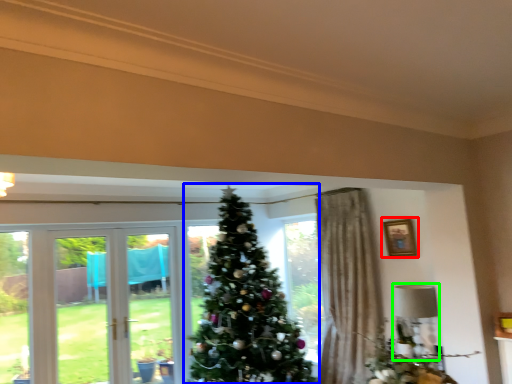
Question: Considering the real-world distances, which object is closest to picture frame (highlighted by a red box)? christmas tree (highlighted by a blue box) or lamp (highlighted by a green box).

Choices:
 (A) christmas tree
 (B) lamp

Answer: (B)